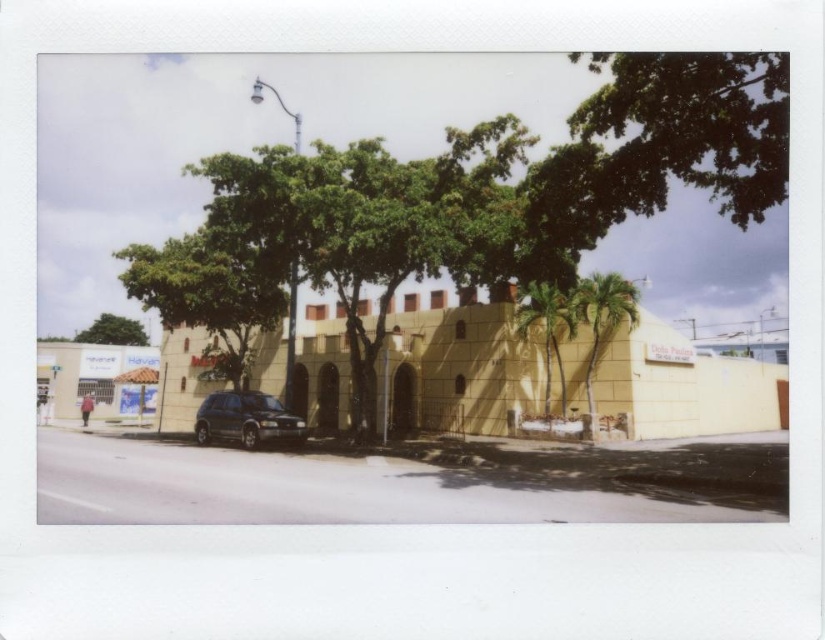
You are standing on the sidewalk in front of the beige building. You notice two green leafy trees. Which tree, the green leafy tree at center or the green leafy tree at upper right, is closer to you?

The green leafy tree at center is closer to you because the green leafy tree at upper right is behind it.

You are standing at the point marked as point (496, 202). What do you see directly in front of you?

You see a green leafy tree at center directly in front of you at point (496, 202).